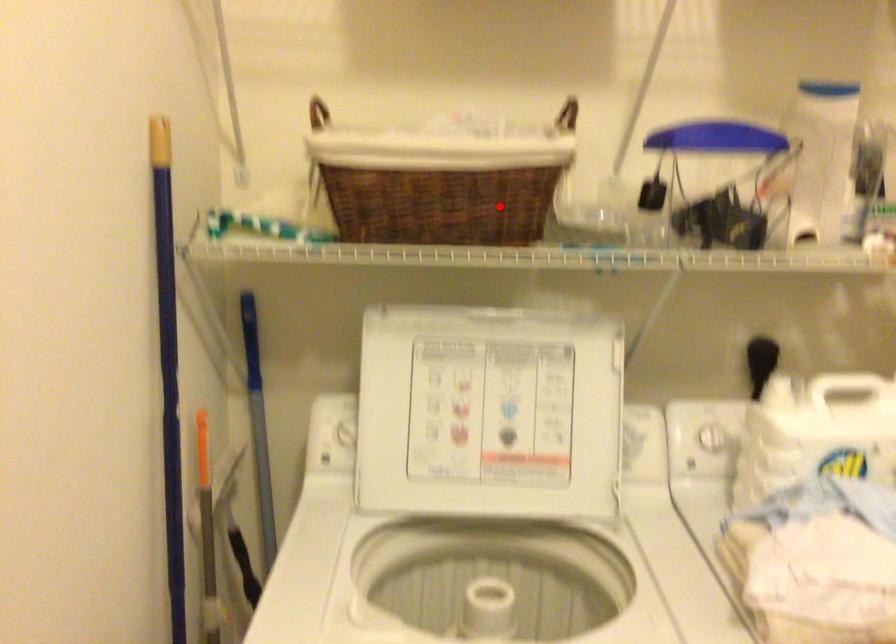
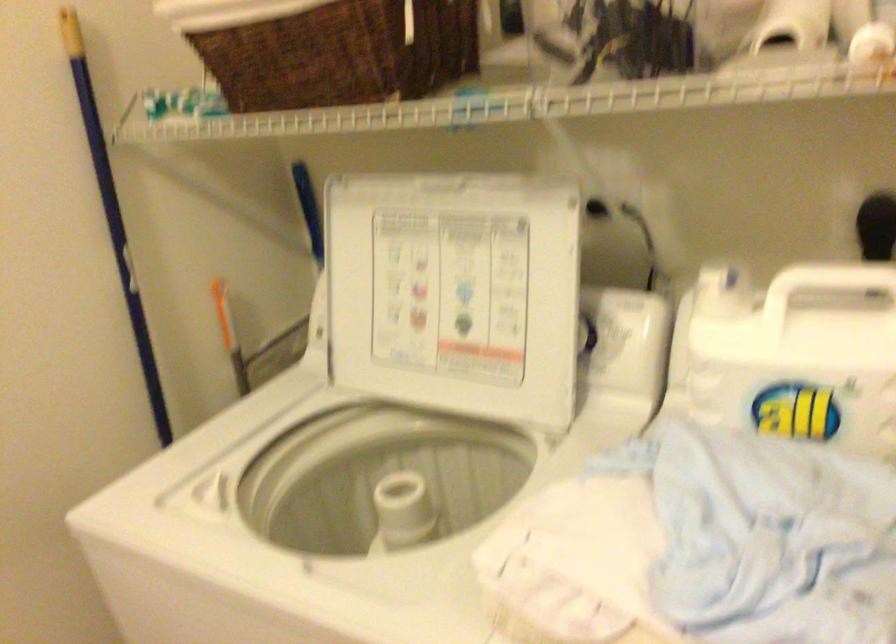
Find the pixel in the second image that matches the highlighted location in the first image.

(340, 53)